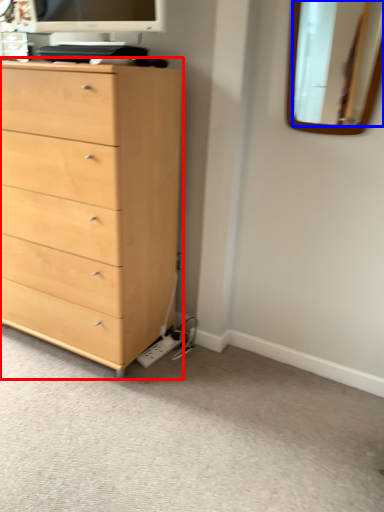
Question: Which object is further to the camera taking this photo, chest of drawers (highlighted by a red box) or mirror (highlighted by a blue box)?

Choices:
 (A) chest of drawers
 (B) mirror

Answer: (B)